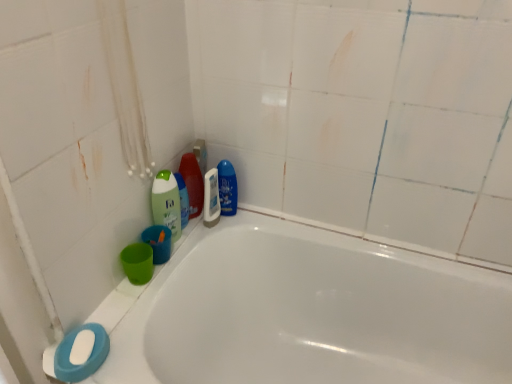
Question: In the image, is blue glossy bottle at upper center, which appears as the fourth cleaning product when viewed from the left, on the left side or the right side of green matte bottle at upper left, the first cleaning product positioned from the left?

Choices:
 (A) right
 (B) left

Answer: (A)

Question: Is blue glossy bottle at upper center, which appears as the fourth cleaning product when viewed from the left, wider or thinner than green matte bottle at upper left, arranged as the fourth cleaning product when viewed from the right?

Choices:
 (A) thin
 (B) wide

Answer: (A)

Question: Estimate the real-world distances between objects in this image. Which object is closer to the green matte bottle at upper left, arranged as the fourth cleaning product when viewed from the right?

Choices:
 (A) white glossy bathtub at lower left
 (B) green matte bottle at upper left, the 2th cleaning product when ordered from left to right
 (C) translucent plastic bottle at upper center, the third cleaning product when ordered from left to right
 (D) white glossy mouthwash at center
 (E) blue glossy bottle at upper center, the 1th cleaning product from the right

Answer: (B)

Question: Which is nearer to the white glossy mouthwash at center?

Choices:
 (A) blue glossy bottle at upper center, the 1th cleaning product from the right
 (B) white matte soap at lower left
 (C) translucent plastic bottle at upper center, the third cleaning product when ordered from left to right
 (D) green matte bottle at upper left, arranged as the fourth cleaning product when viewed from the right
 (E) white glossy bathtub at lower left

Answer: (C)